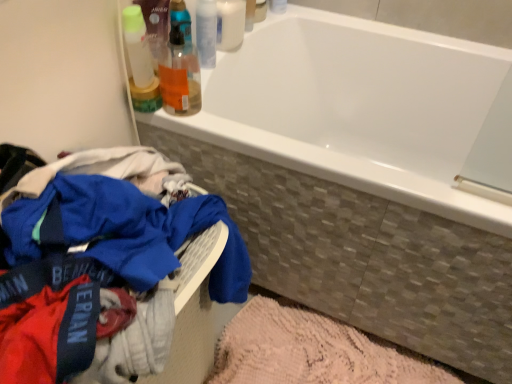
Question: Considering the relative sizes of blue cotton clothes at lower left and white glossy bottle at upper center, arranged as the 3th toiletry when ordered from the bottom, in the image provided, is blue cotton clothes at lower left bigger than white glossy bottle at upper center, arranged as the 3th toiletry when ordered from the bottom,?

Choices:
 (A) no
 (B) yes

Answer: (B)

Question: Does blue cotton clothes at lower left have a lesser height compared to white glossy bottle at upper center, arranged as the 3th toiletry when ordered from the bottom?

Choices:
 (A) yes
 (B) no

Answer: (B)

Question: Is blue cotton clothes at lower left to the left of white glossy bottle at upper center, arranged as the 3th toiletry when ordered from the bottom, from the viewer's perspective?

Choices:
 (A) yes
 (B) no

Answer: (A)

Question: Is blue cotton clothes at lower left behind white glossy bottle at upper center, placed as the 1th toiletry when sorted from top to bottom?

Choices:
 (A) yes
 (B) no

Answer: (B)

Question: Are blue cotton clothes at lower left and white glossy bottle at upper center, placed as the 1th toiletry when sorted from top to bottom, beside each other?

Choices:
 (A) no
 (B) yes

Answer: (A)

Question: Does blue cotton clothes at lower left appear on the right side of white glossy bottle at upper center, arranged as the 3th toiletry when ordered from the bottom?

Choices:
 (A) no
 (B) yes

Answer: (A)

Question: Can you confirm if translucent plastic bottles at upper left, which is the 3th toiletry from top to bottom, is bigger than blue cotton clothes at lower left?

Choices:
 (A) no
 (B) yes

Answer: (A)

Question: From a real-world perspective, does translucent plastic bottles at upper left, which is the first toiletry from bottom to top, sit lower than blue cotton clothes at lower left?

Choices:
 (A) yes
 (B) no

Answer: (B)

Question: Is translucent plastic bottles at upper left, which is the 3th toiletry from top to bottom, taller than blue cotton clothes at lower left?

Choices:
 (A) yes
 (B) no

Answer: (B)

Question: Is the position of translucent plastic bottles at upper left, which is the first toiletry from bottom to top, more distant than that of blue cotton clothes at lower left?

Choices:
 (A) yes
 (B) no

Answer: (A)

Question: Can you confirm if translucent plastic bottles at upper left, which is the 3th toiletry from top to bottom, is thinner than blue cotton clothes at lower left?

Choices:
 (A) no
 (B) yes

Answer: (B)

Question: Is translucent plastic bottles at upper left, which is the 3th toiletry from top to bottom, at the right side of blue cotton clothes at lower left?

Choices:
 (A) yes
 (B) no

Answer: (A)

Question: Can blue cotton clothes at lower left be found inside white glossy bottle at upper center, placed as the 2th toiletry when sorted from bottom to top?

Choices:
 (A) no
 (B) yes

Answer: (A)